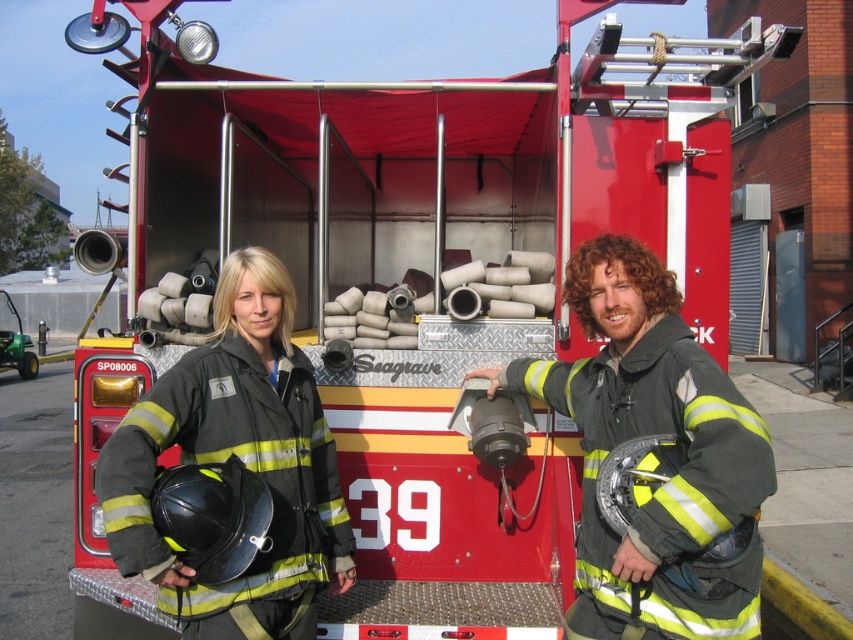
Question: Which object appears closest to the camera in this image?

Choices:
 (A) black matte uniform at right
 (B) black matte uniform at left

Answer: (A)

Question: Is black matte uniform at right further to camera compared to black matte uniform at left?

Choices:
 (A) yes
 (B) no

Answer: (B)

Question: From the image, what is the correct spatial relationship of black matte uniform at right in relation to black matte uniform at left?

Choices:
 (A) left
 (B) right

Answer: (B)

Question: Which point is farther to the camera?

Choices:
 (A) (171, 612)
 (B) (709, 369)

Answer: (A)

Question: Which point is farther to the camera?

Choices:
 (A) (587, 561)
 (B) (155, 406)

Answer: (A)

Question: Considering the relative positions of black matte uniform at right and black matte uniform at left in the image provided, where is black matte uniform at right located with respect to black matte uniform at left?

Choices:
 (A) below
 (B) above

Answer: (B)